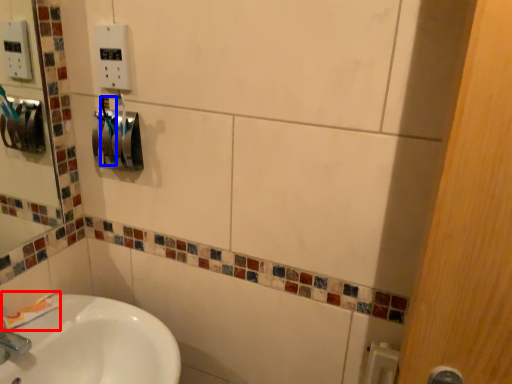
Question: Which object is closer to the camera taking this photo, toothpaste (highlighted by a red box) or toothbrush (highlighted by a blue box)?

Choices:
 (A) toothpaste
 (B) toothbrush

Answer: (B)